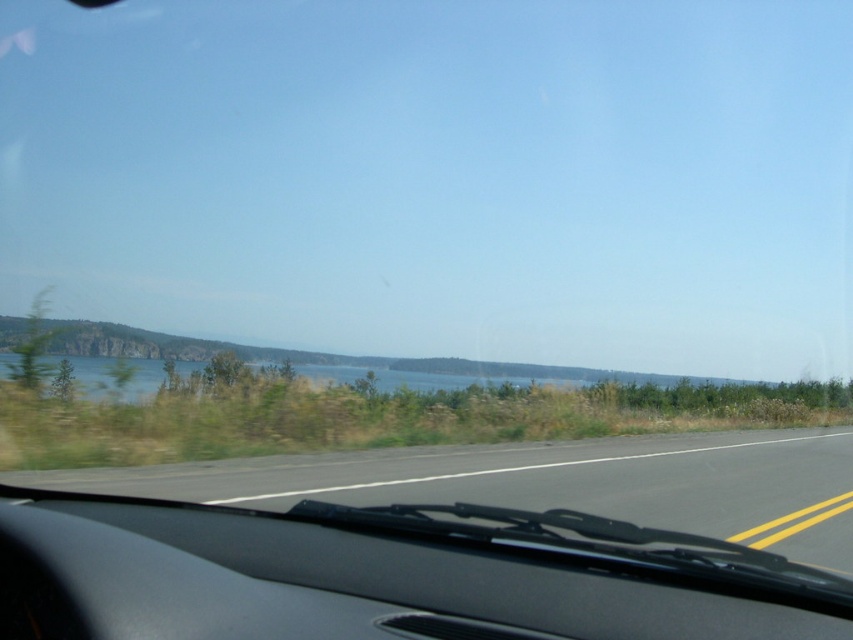
You are driving a car and need to check both the black matte dashboard at center and the black asphalt road at center. Which one appears wider from your current viewpoint?

The black asphalt road at center appears wider than the black matte dashboard at center because the dashboard has a lesser width compared to the asphalt road.